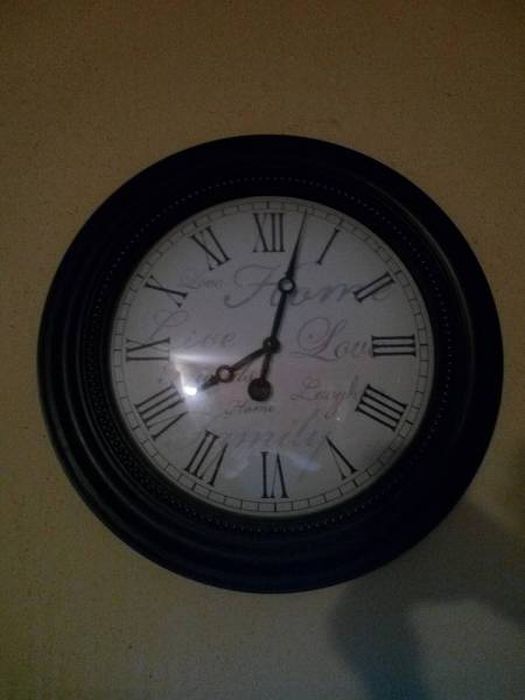
The height and width of the screenshot is (700, 525). I want to click on clock, so click(300, 290).